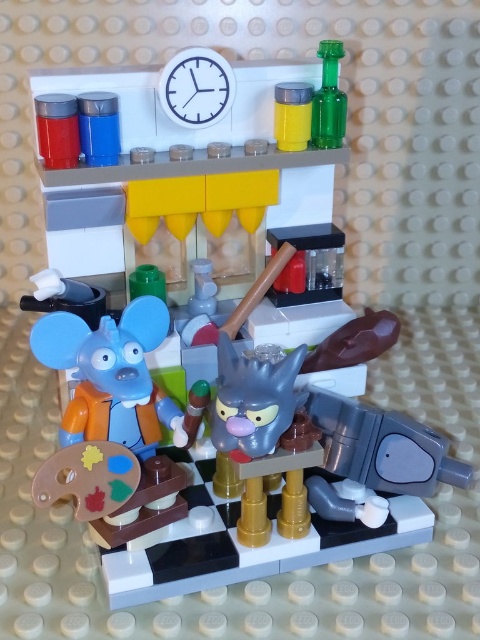
Does point (230, 81) come farther from viewer compared to point (345, 109)?

No, it is in front of (345, 109).

Is white plastic clock at upper center below green glass bottle at upper right?

Yes.

Locate an element on the screen. white plastic clock at upper center is located at coordinates (196, 88).